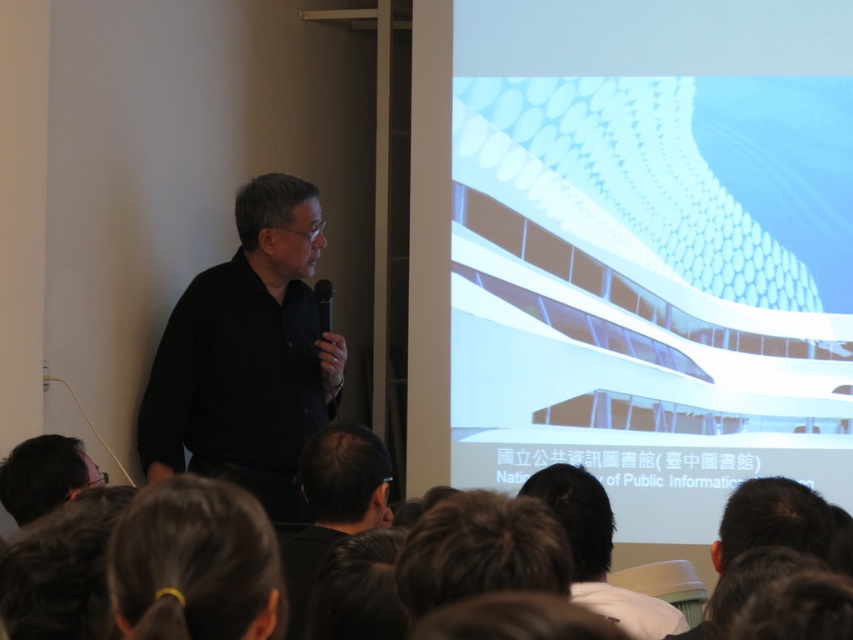
Can you confirm if black matte hair at lower center is positioned above black matte shirt at lower center?

Indeed, black matte hair at lower center is positioned over black matte shirt at lower center.

Which of these two, black matte hair at lower center or black matte shirt at lower center, stands shorter?

black matte shirt at lower center

Is point (303, 474) behind point (585, 577)?

Yes, point (303, 474) is farther from viewer.

Locate an element on the screen. black matte hair at lower center is located at coordinates (334, 506).

Does point (228, 300) come behind point (328, 426)?

That is True.

Can you confirm if black matte shirt at center is positioned to the left of black matte hair at lower center?

Correct, you'll find black matte shirt at center to the left of black matte hair at lower center.

This screenshot has width=853, height=640. Find the location of `black matte shirt at center`. black matte shirt at center is located at coordinates 247,355.

Can you confirm if dark brown hair at lower left is positioned above black matte hair at lower center?

Yes.

Does dark brown hair at lower left lie behind black matte hair at lower center?

No, dark brown hair at lower left is closer to the viewer.

Between point (238, 579) and point (343, 444), which one is positioned behind?

The point (343, 444) is more distant.

Where is `dark brown hair at lower left`? This screenshot has width=853, height=640. dark brown hair at lower left is located at coordinates (195, 563).